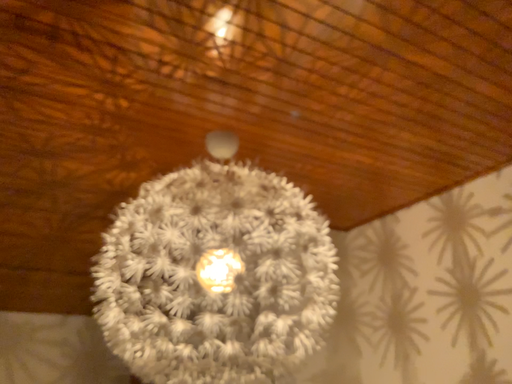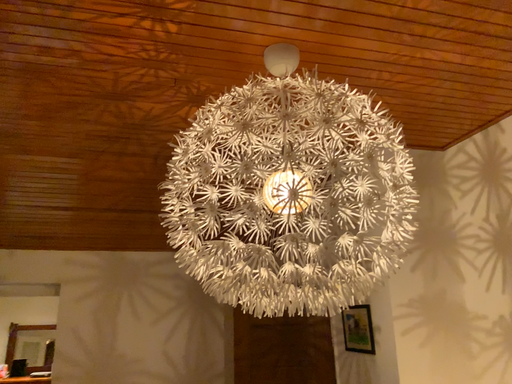
Question: How did the camera likely rotate when shooting the video?

Choices:
 (A) rotated right
 (B) rotated left

Answer: (B)